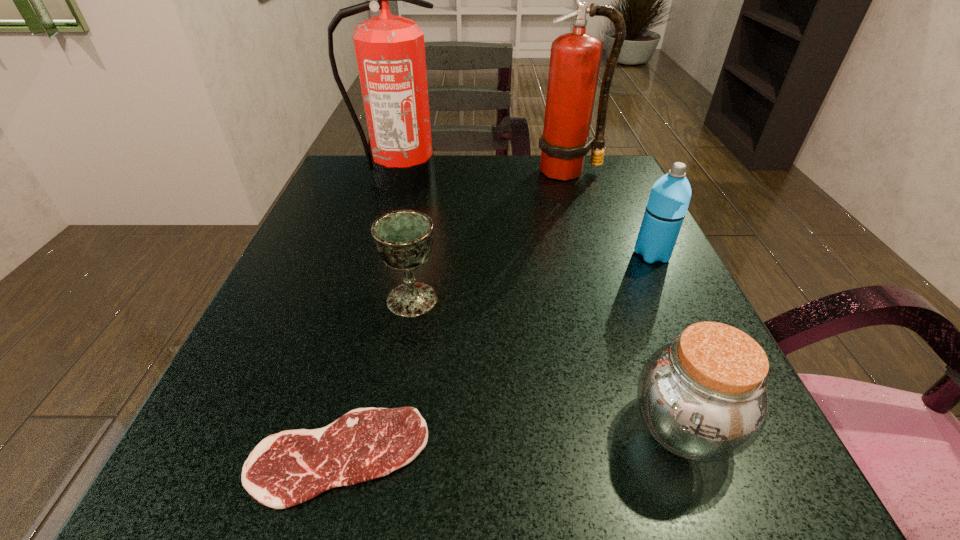
Image resolution: width=960 pixels, height=540 pixels. What are the coordinates of `free space located on the right of the third nearest object` in the screenshot? It's located at (606, 300).

What are the coordinates of `vacant space located on the back of the jar` in the screenshot? It's located at (616, 251).

The height and width of the screenshot is (540, 960). In order to click on free space located 0.120m on the right of the steak in this screenshot , I will do `click(525, 456)`.

At what (x,y) coordinates should I click in order to perform the action: click on jar that is at the near edge. Please return your answer as a coordinate pair (x, y). This screenshot has height=540, width=960. Looking at the image, I should click on (703, 397).

Identify the location of steak that is at the near edge. The image size is (960, 540). (285, 469).

The height and width of the screenshot is (540, 960). What are the coordinates of `fire extinguisher that is positioned at the left edge` in the screenshot? It's located at (390, 51).

This screenshot has width=960, height=540. In order to click on steak that is at the left edge in this screenshot , I will do `click(285, 469)`.

Identify the location of fire extinguisher at the right edge. (575, 58).

At what (x,y) coordinates should I click in order to perform the action: click on thermos bottle that is at the right edge. Please return your answer as a coordinate pair (x, y). Image resolution: width=960 pixels, height=540 pixels. Looking at the image, I should click on (667, 205).

I want to click on jar located at the right edge, so click(703, 397).